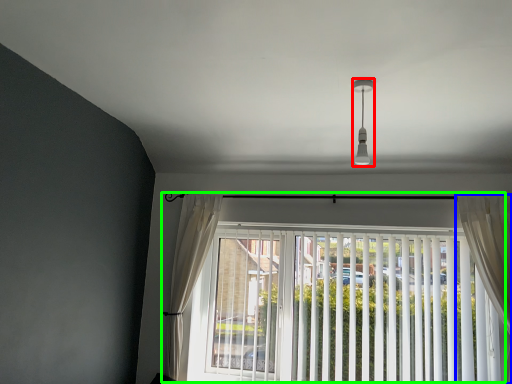
Question: Which is farther away from light fixture (highlighted by a red box)? curtain (highlighted by a blue box) or window (highlighted by a green box)?

Choices:
 (A) curtain
 (B) window

Answer: (B)